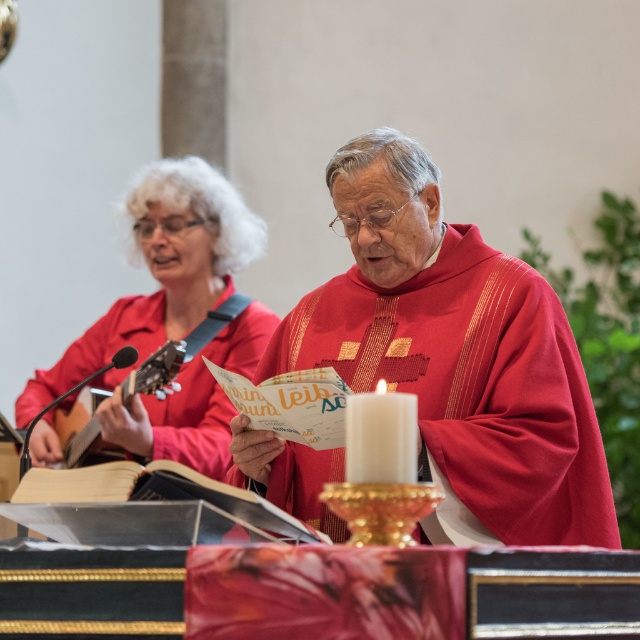
You are an interior designer planning to place a new decorative item between the matte red shirt at upper left and the white wax candle at center. Given their sizes, which object should you consider moving to accommodate the new item?

The matte red shirt at upper left has a larger size compared to the white wax candle at center. Therefore, you should consider moving the matte red shirt at upper left to create more space for the new decorative item.

You are an event planner setting up for a small concert in this space. You need to place a new amplifier that is 1.2 meters tall. The amplifier must be placed between the white wax candle at center and the acoustic wood guitar at left. Is there enough vertical space between them for the amplifier?

The white wax candle at center is shorter than the acoustic wood guitar at left. Since the amplifier is 1.2 meters tall, it needs to be placed between them vertically. However, the description only provides information about their height comparison, not the actual vertical distance between them. Therefore, we cannot determine if there is enough vertical space based on the given information.